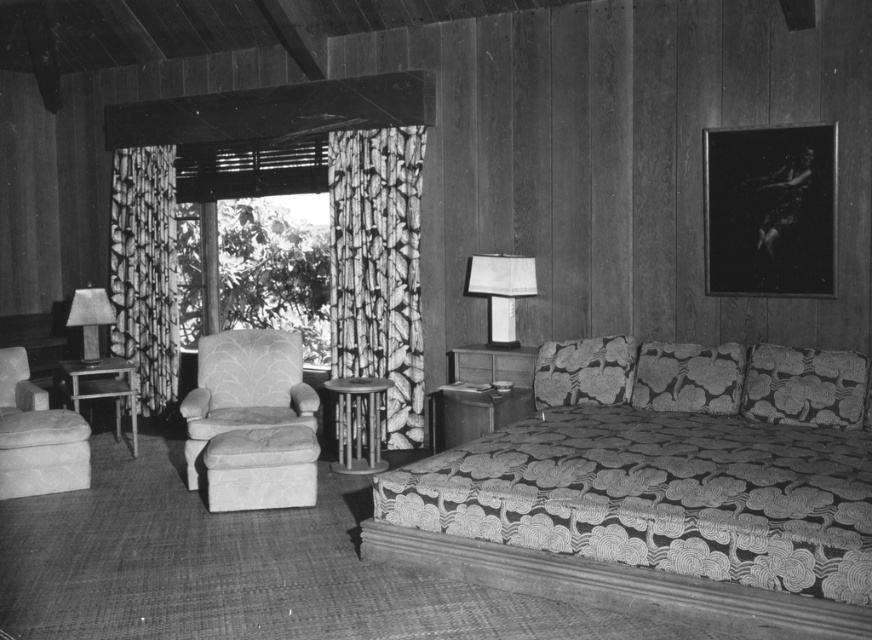
Which is in front, point (641, 362) or point (73, 300)?

Point (641, 362) is in front.

Locate an element on the screen. floral-patterned fabric pillow at center is located at coordinates (687, 378).

Locate an element on the screen. Image resolution: width=872 pixels, height=640 pixels. floral-patterned fabric pillow at center is located at coordinates (687, 378).

Does point (138, 273) come in front of point (573, 358)?

No.

Is patterned fabric curtain at left further to the viewer compared to floral fabric pillow at center?

Yes, patterned fabric curtain at left is further from the viewer.

Is point (133, 184) behind point (603, 378)?

Yes, it is.

Where is `patterned fabric curtain at left`? This screenshot has height=640, width=872. patterned fabric curtain at left is located at coordinates (145, 269).

From the picture: Can you confirm if patterned fabric curtain at left is positioned to the left of patterned fabric armchair at center?

Yes, patterned fabric curtain at left is to the left of patterned fabric armchair at center.

Does patterned fabric curtain at left have a lesser width compared to patterned fabric armchair at center?

Yes, patterned fabric curtain at left is thinner than patterned fabric armchair at center.

Does point (160, 292) lie behind point (293, 358)?

Yes, it is.

At what (x,y) coordinates should I click in order to perform the action: click on patterned fabric curtain at left. Please return your answer as a coordinate pair (x, y). This screenshot has height=640, width=872. Looking at the image, I should click on (145, 269).